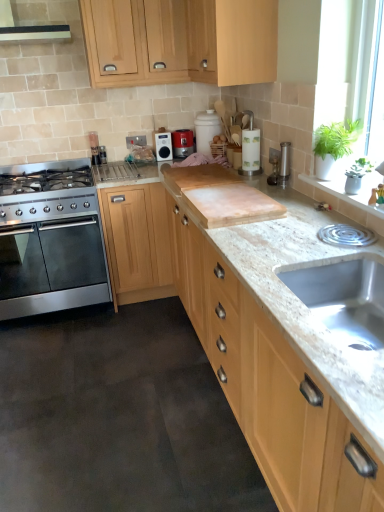
Question: Is light wood cabinet at upper center, which is the first cabinetry from top to bottom, situated inside stainless steel gas stove at left or outside?

Choices:
 (A) outside
 (B) inside

Answer: (A)

Question: Is light wood cabinet at upper center, the third cabinetry ordered from the bottom, in front of or behind stainless steel gas stove at left in the image?

Choices:
 (A) behind
 (B) front

Answer: (B)

Question: Considering the real-world distances, which object is farthest from the metallic silver toaster at upper center?

Choices:
 (A) light wood cabinet at upper center, which is the second cabinetry from bottom to top
 (B) green leafy plant at upper right
 (C) stainless steel oven at left
 (D) matte black radio at center, arranged as the first kitchen appliance when viewed from the left
 (E) light wood cabinet at center, the 1th cabinetry when ordered from bottom to top

Answer: (B)

Question: Estimate the real-world distances between objects in this image. Which object is farther from the metallic silver toaster at upper center?

Choices:
 (A) green leafy plant at upper right
 (B) metallic silver toaster at center, which is counted as the 1th kitchen appliance, starting from the right
 (C) light wood cabinet at upper center, the third cabinetry ordered from the bottom
 (D) stainless steel oven at left
 (E) matte black radio at center, arranged as the first kitchen appliance when viewed from the left

Answer: (A)